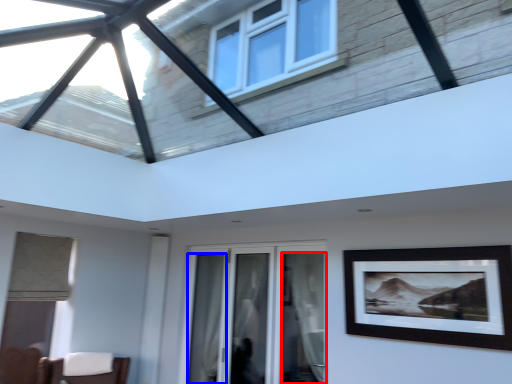
Question: Which point is closer to the camera, curtain (highlighted by a red box) or curtain (highlighted by a blue box)?

Choices:
 (A) curtain
 (B) curtain

Answer: (A)